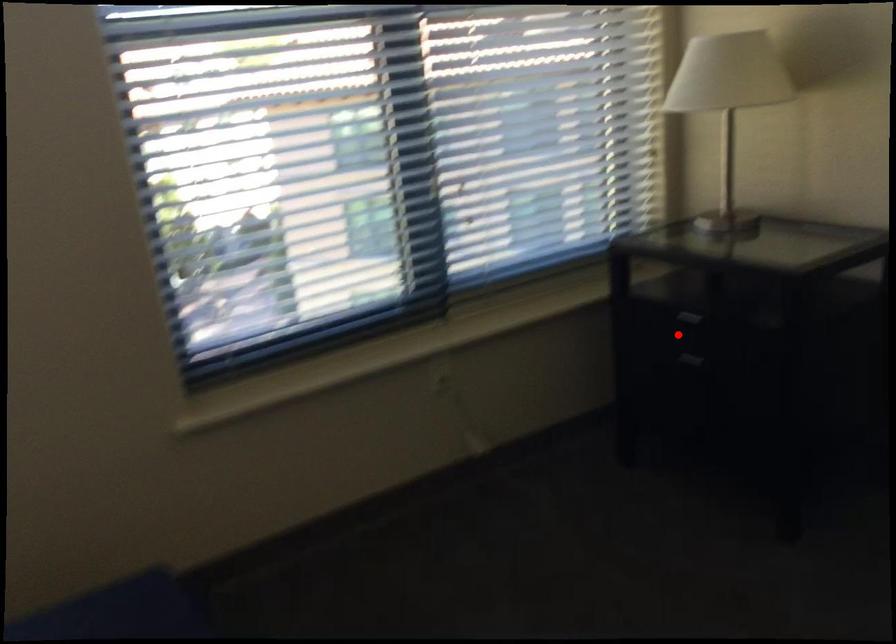
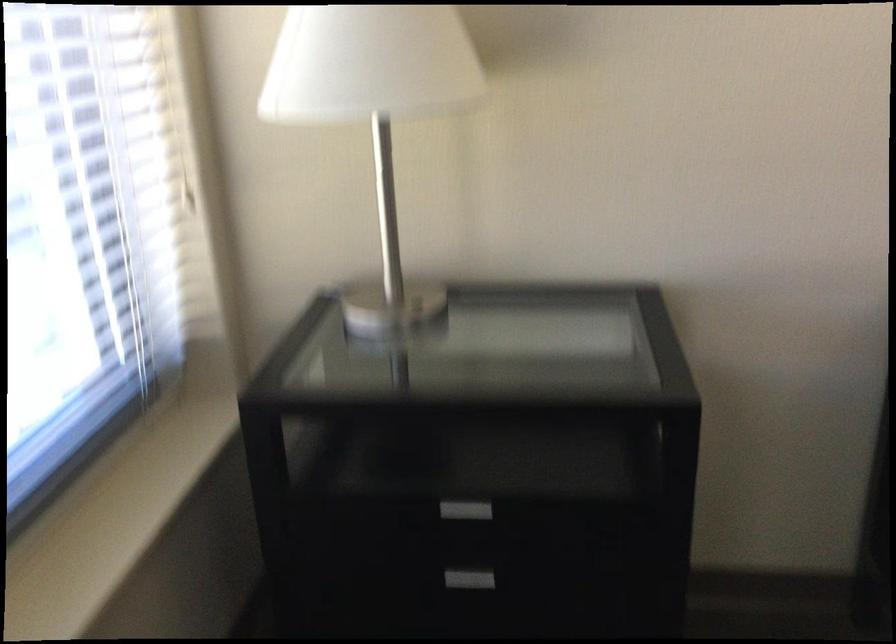
The point at the highlighted location is marked in the first image. Where is the corresponding point in the second image?

(461, 511)